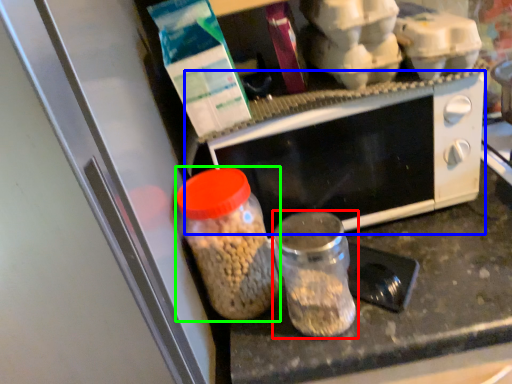
Question: Based on their relative distances, which object is nearer to bottle (highlighted by a red box)? Choose from microwave oven (highlighted by a blue box) and bottle (highlighted by a green box).

Choices:
 (A) microwave oven
 (B) bottle

Answer: (B)